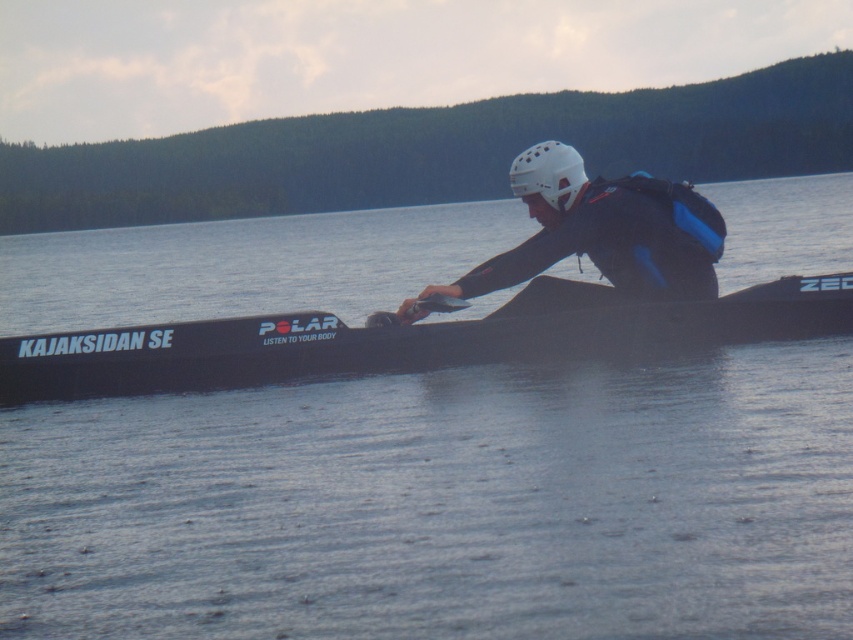
Who is positioned more to the right, black matte wetsuit at center or white matte helmet at center?

black matte wetsuit at center is more to the right.

Image resolution: width=853 pixels, height=640 pixels. What are the coordinates of `black matte wetsuit at center` in the screenshot? It's located at (x=604, y=230).

Can you confirm if black matte kayak at center is wider than white matte helmet at center?

Indeed, black matte kayak at center has a greater width compared to white matte helmet at center.

Can you confirm if black matte kayak at center is taller than white matte helmet at center?

Yes.

Who is more forward, (x=746, y=289) or (x=529, y=157)?

Point (x=529, y=157)

This screenshot has width=853, height=640. I want to click on black matte kayak at center, so click(404, 339).

Where is `transparent water at center`? This screenshot has height=640, width=853. transparent water at center is located at coordinates (444, 502).

Between transparent water at center and white matte helmet at center, which one has more height?

With more height is transparent water at center.

Which is behind, point (119, 525) or point (541, 179)?

The point (541, 179) is behind.

This screenshot has width=853, height=640. I want to click on transparent water at center, so click(x=444, y=502).